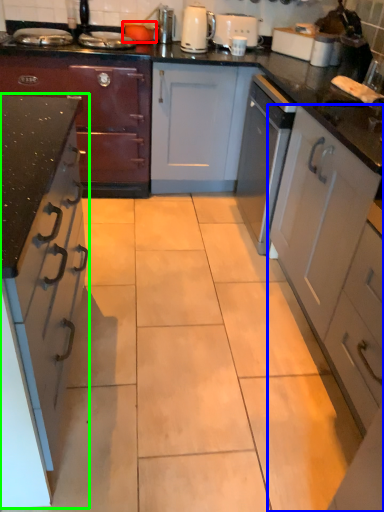
Question: Based on their relative distances, which object is farther from appliance (highlighted by a red box)? Choose from cabinetry (highlighted by a blue box) and cabinetry (highlighted by a green box).

Choices:
 (A) cabinetry
 (B) cabinetry

Answer: (B)